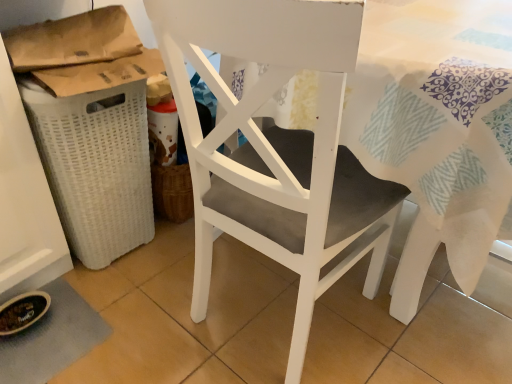
Question: Is white woven laundry basket at left turned away from white matte chair at center?

Choices:
 (A) no
 (B) yes

Answer: (A)

Question: Considering the relative positions of white woven laundry basket at left and white matte chair at center in the image provided, is white woven laundry basket at left to the right of white matte chair at center from the viewer's perspective?

Choices:
 (A) yes
 (B) no

Answer: (B)

Question: Is white woven laundry basket at left oriented towards white matte chair at center?

Choices:
 (A) no
 (B) yes

Answer: (B)

Question: From the image's perspective, does white woven laundry basket at left appear lower than white matte chair at center?

Choices:
 (A) no
 (B) yes

Answer: (A)

Question: Does white woven laundry basket at left appear on the left side of white matte chair at center?

Choices:
 (A) no
 (B) yes

Answer: (B)

Question: Does white woven laundry basket at left have a greater height compared to white matte chair at center?

Choices:
 (A) yes
 (B) no

Answer: (B)

Question: From the image's perspective, is white matte chair at center beneath white woven laundry basket at left?

Choices:
 (A) yes
 (B) no

Answer: (A)

Question: Can you confirm if white matte chair at center is positioned to the right of white woven laundry basket at left?

Choices:
 (A) yes
 (B) no

Answer: (A)

Question: Considering the relative sizes of white matte chair at center and white woven laundry basket at left in the image provided, is white matte chair at center shorter than white woven laundry basket at left?

Choices:
 (A) yes
 (B) no

Answer: (B)

Question: Is white matte chair at center taller than white woven laundry basket at left?

Choices:
 (A) no
 (B) yes

Answer: (B)

Question: Is white matte chair at center not near white woven laundry basket at left?

Choices:
 (A) yes
 (B) no

Answer: (B)

Question: Is white matte chair at center thinner than white woven laundry basket at left?

Choices:
 (A) no
 (B) yes

Answer: (A)

Question: Looking at their shapes, would you say white woven laundry basket at left is wider or thinner than white matte chair at center?

Choices:
 (A) thin
 (B) wide

Answer: (A)